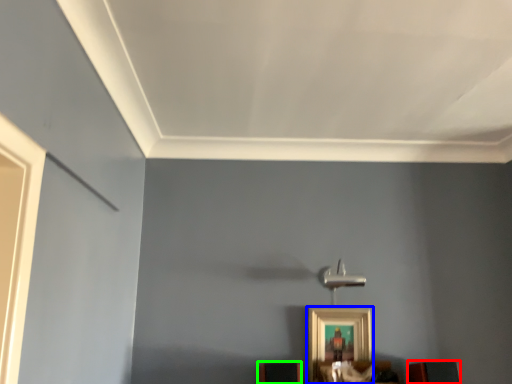
Question: Which is nearer to the furniture (highlighted by a red box)? picture frame (highlighted by a blue box) or furniture (highlighted by a green box).

Choices:
 (A) picture frame
 (B) furniture

Answer: (A)